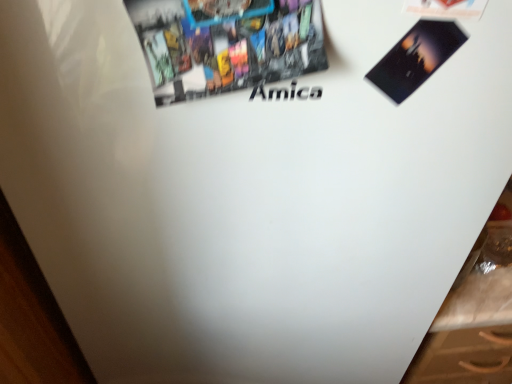
Measure the distance between matte paper flyer at upper right and camera.

matte paper flyer at upper right is 14.41 inches from camera.

Looking at this image, what is the approximate height of matte paper flyer at upper right?

4.00 inches.

The width and height of the screenshot is (512, 384). What do you see at coordinates (416, 58) in the screenshot? I see `matte paper flyer at upper right` at bounding box center [416, 58].

Locate an element on the screen. matte paper flyer at upper right is located at coordinates (416, 58).

In order to click on matte paper poster at upper center in this screenshot , I will do `click(226, 44)`.

What do you see at coordinates (226, 44) in the screenshot? I see `matte paper poster at upper center` at bounding box center [226, 44].

This screenshot has height=384, width=512. Find the location of `matte paper flyer at upper right`. matte paper flyer at upper right is located at coordinates (416, 58).

Which is more to the left, matte paper flyer at upper right or matte paper poster at upper center?

matte paper poster at upper center is more to the left.

Which is in front, matte paper flyer at upper right or matte paper poster at upper center?

matte paper poster at upper center.

Considering the points (373, 68) and (315, 21), which point is in front, point (373, 68) or point (315, 21)?

Positioned in front is point (315, 21).

From the image's perspective, between matte paper flyer at upper right and matte paper poster at upper center, who is located below?

matte paper poster at upper center appears lower in the image.

From a real-world perspective, is matte paper flyer at upper right over matte paper poster at upper center?

No, from a real-world perspective, matte paper flyer at upper right is not on top of matte paper poster at upper center.

Considering the sizes of objects matte paper flyer at upper right and matte paper poster at upper center in the image provided, who is thinner, matte paper flyer at upper right or matte paper poster at upper center?

With smaller width is matte paper poster at upper center.

Looking at this image, can you confirm if matte paper flyer at upper right is shorter than matte paper poster at upper center?

Yes.

Can you confirm if matte paper flyer at upper right is smaller than matte paper poster at upper center?

Indeed, matte paper flyer at upper right has a smaller size compared to matte paper poster at upper center.

Would you say matte paper flyer at upper right is outside matte paper poster at upper center?

Absolutely, matte paper flyer at upper right is external to matte paper poster at upper center.

Is matte paper flyer at upper right far from matte paper poster at upper center?

No, matte paper flyer at upper right is not far from matte paper poster at upper center.

From the picture: Is matte paper flyer at upper right positioned with its back to matte paper poster at upper center?

No, matte paper flyer at upper right is not facing the opposite direction of matte paper poster at upper center.

How distant is matte paper flyer at upper right from matte paper poster at upper center?

They are 4.98 inches apart.

The height and width of the screenshot is (384, 512). I want to click on flyer located behind the matte paper poster at upper center, so 416,58.

In the image, is matte paper poster at upper center on the left side or the right side of matte paper flyer at upper right?

Clearly, matte paper poster at upper center is on the left of matte paper flyer at upper right in the image.

Which object is further away from the camera, matte paper poster at upper center or matte paper flyer at upper right?

matte paper flyer at upper right.

Considering the points (287, 21) and (443, 30), which point is in front, point (287, 21) or point (443, 30)?

Point (287, 21)

From the image's perspective, is matte paper poster at upper center above or below matte paper flyer at upper right?

Based on their image positions, matte paper poster at upper center is located beneath matte paper flyer at upper right.

From a real-world perspective, is matte paper poster at upper center positioned over matte paper flyer at upper right based on gravity?

Yes, from a real-world perspective, matte paper poster at upper center is on top of matte paper flyer at upper right.

Which of these two, matte paper poster at upper center or matte paper flyer at upper right, is wider?

With larger width is matte paper flyer at upper right.

Considering the sizes of objects matte paper poster at upper center and matte paper flyer at upper right in the image provided, who is taller, matte paper poster at upper center or matte paper flyer at upper right?

With more height is matte paper poster at upper center.

In terms of size, does matte paper poster at upper center appear bigger or smaller than matte paper flyer at upper right?

In the image, matte paper poster at upper center appears to be larger than matte paper flyer at upper right.

Choose the correct answer: Is matte paper poster at upper center inside matte paper flyer at upper right or outside it?

matte paper poster at upper center is not inside matte paper flyer at upper right, it's outside.

Does matte paper poster at upper center touch matte paper flyer at upper right?

No, matte paper poster at upper center is not with matte paper flyer at upper right.

Could you tell me if matte paper poster at upper center is facing matte paper flyer at upper right?

No, matte paper poster at upper center is not oriented towards matte paper flyer at upper right.

Locate an element on the screen. This screenshot has width=512, height=384. flyer that appears behind the matte paper poster at upper center is located at coordinates (416, 58).

The width and height of the screenshot is (512, 384). I want to click on poster above the matte paper flyer at upper right (from a real-world perspective), so click(226, 44).

This screenshot has height=384, width=512. What are the coordinates of `flyer to the right of matte paper poster at upper center` in the screenshot? It's located at (416, 58).